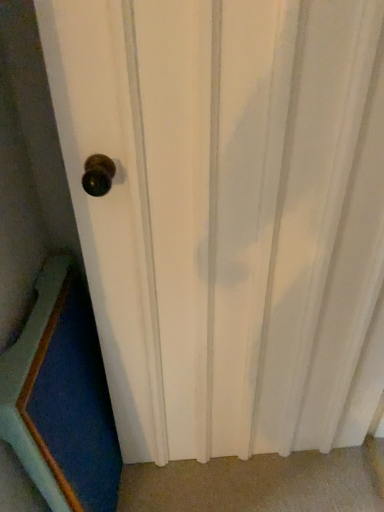
This screenshot has width=384, height=512. Identify the location of blue fabric radiator at lower left. (61, 398).

What do you see at coordinates (61, 398) in the screenshot? I see `blue fabric radiator at lower left` at bounding box center [61, 398].

Identify the location of blue fabric radiator at lower left. [x=61, y=398].